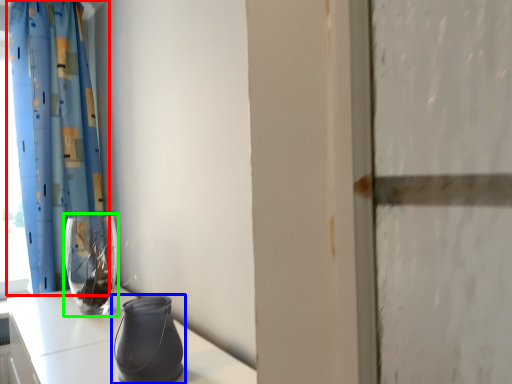
Question: Based on their relative distances, which object is nearer to curtain (highlighted by a red box)? Choose from vase (highlighted by a blue box) and vase (highlighted by a green box).

Choices:
 (A) vase
 (B) vase

Answer: (B)